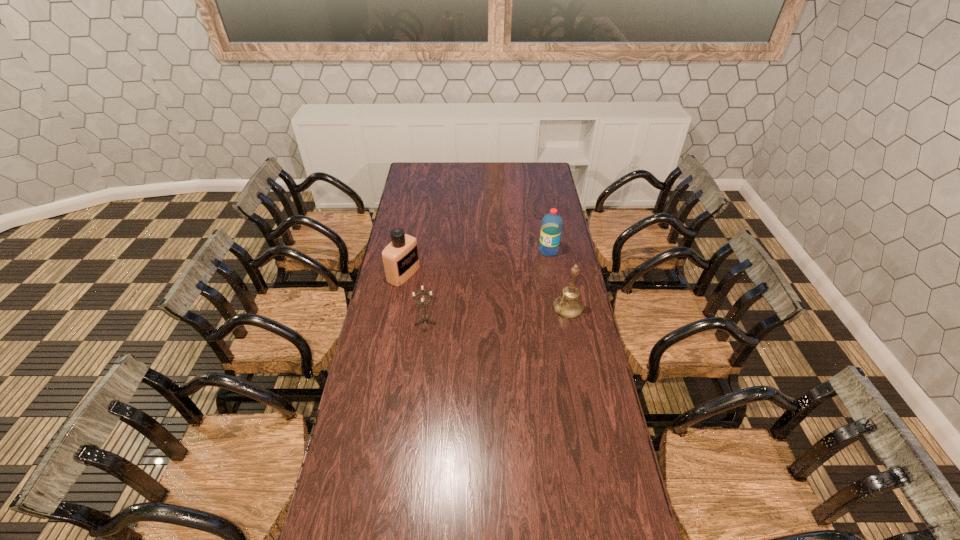
You are a GUI agent. You are given a task and a screenshot of the screen. Output one action in this format:
    pyautogui.click(x=<x>, y=<y>)
    Task: Click on the free space on the desktop that is between the second object from left to right and the bell and is positioned on the front label of the water bottle
    The height and width of the screenshot is (540, 960).
    Given the screenshot: What is the action you would take?
    pyautogui.click(x=482, y=315)

You are a GUI agent. You are given a task and a screenshot of the screen. Output one action in this format:
    pyautogui.click(x=<x>, y=<y>)
    Task: Click on the free space on the desktop that is between the second object from left to right and the bell and is positioned on the front label of the leftmost object
    Image resolution: width=960 pixels, height=540 pixels.
    Given the screenshot: What is the action you would take?
    pyautogui.click(x=496, y=314)